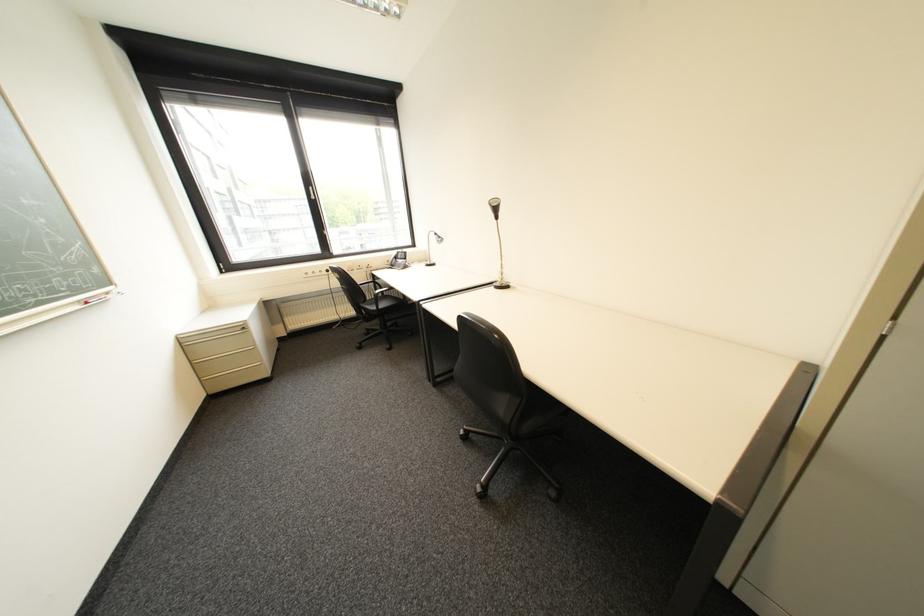
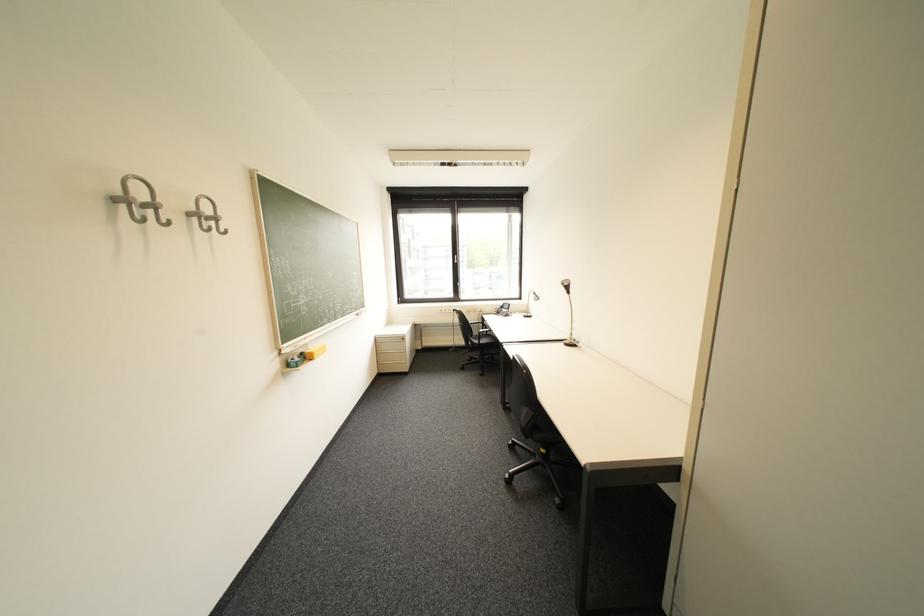
Where in the second image is the point corresponding to [387,292] from the first image?

(492, 331)